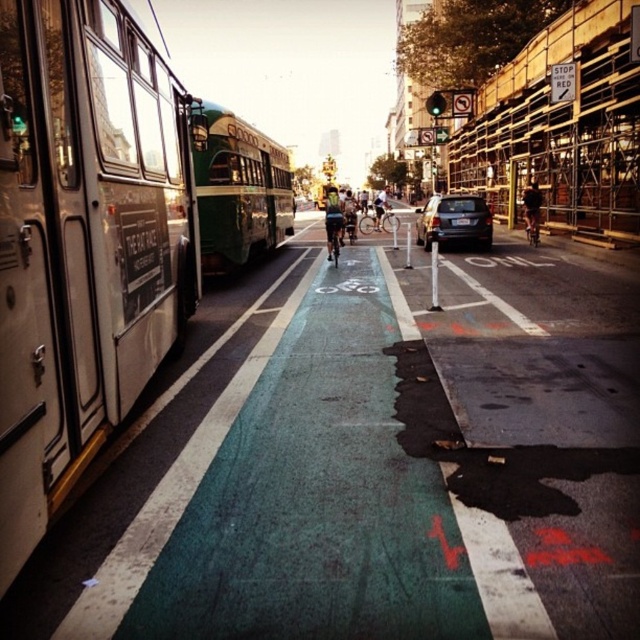
Does green matte bus at center come in front of reflective silver bicycle at center?

Yes, green matte bus at center is in front of reflective silver bicycle at center.

Is green matte bus at center shorter than reflective silver bicycle at center?

Incorrect, green matte bus at center's height does not fall short of reflective silver bicycle at center's.

Image resolution: width=640 pixels, height=640 pixels. What are the coordinates of `green matte bus at center` in the screenshot? It's located at (240, 193).

Is green matte bus at center smaller than matte black suv at center?

No.

Is point (240, 131) behind point (486, 221)?

That is False.

Where is `green matte bus at center`? green matte bus at center is located at coordinates (240, 193).

Identify the location of green matte bus at center. (240, 193).

Between dark blue jeans at center and matte black bicycle at center, which one is positioned lower?

Positioned lower is dark blue jeans at center.

Looking at this image, which of these two, dark blue jeans at center or matte black bicycle at center, stands shorter?

dark blue jeans at center is shorter.

Does point (536, 221) come in front of point (353, 216)?

Yes, point (536, 221) is in front of point (353, 216).

Where is `dark blue jeans at center`? Image resolution: width=640 pixels, height=640 pixels. dark blue jeans at center is located at coordinates (531, 211).